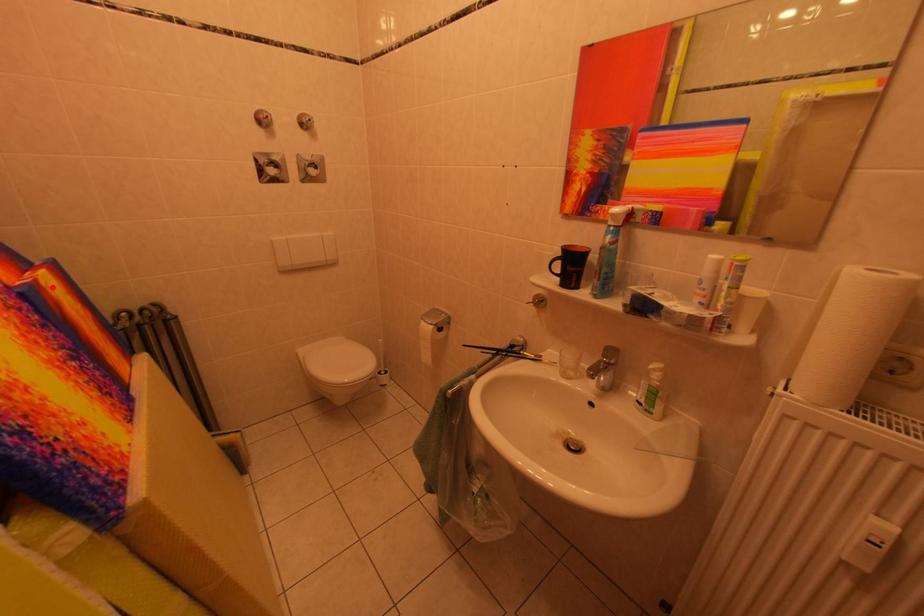
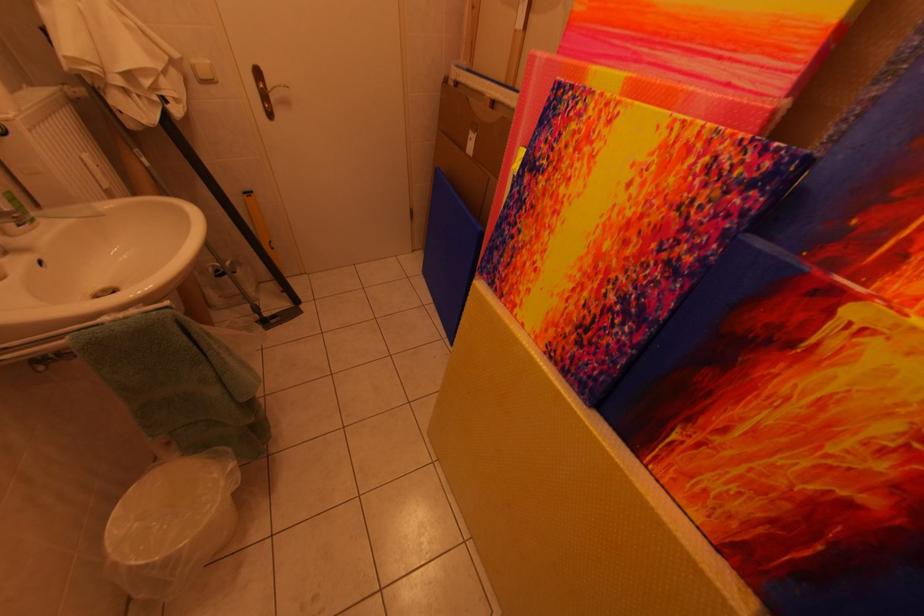
Where in the second image is the point corresponding to the highlighted location from the first image?

(861, 317)